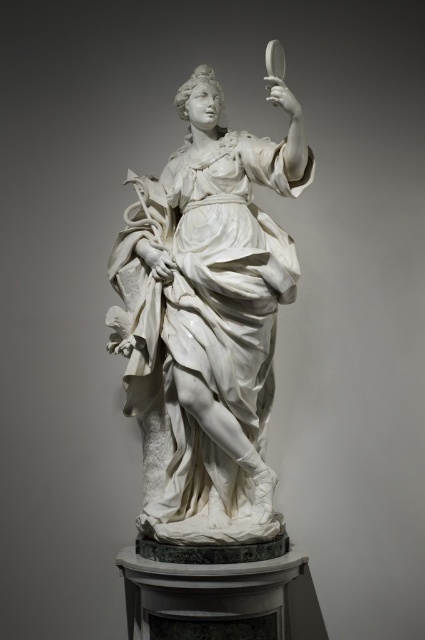
You are an art student standing in front of the white marble statue at center and the transparent glass magnifying glass at upper right. You want to sketch the statue first. Which object should you look at first to start your drawing?

You should look at the white marble statue at center first because it is positioned on the left side of the transparent glass magnifying glass at upper right, making it closer to your field of view when starting to sketch.

You are an art conservator standing at the entrance of the gallery. You need to move a protective barrier around the white marble statue at center to prevent visitors from getting too close. The barrier is a circular ring with a radius of 2 meters. What is the minimum distance from the entrance you should place the center of the barrier to ensure the statue is fully enclosed within the barrier?

The white marble statue at center is located at point (209, 314). To fully enclose it within a 2 meter radius barrier, the center of the barrier should be placed at least 2 meters away from the statue. However, the exact placement depends on the entrance location and gallery layout not provided here. Without additional spatial data, the safest minimum distance is 2 meters from the statue.

You are an art student standing in front of the white marble statue at center and the transparent glass magnifying glass at upper right. You want to sketch the statue first. Which object should you look at first?

You should look at the white marble statue at center first because it is closer to you than the transparent glass magnifying glass at upper right, making it easier to observe details for sketching.